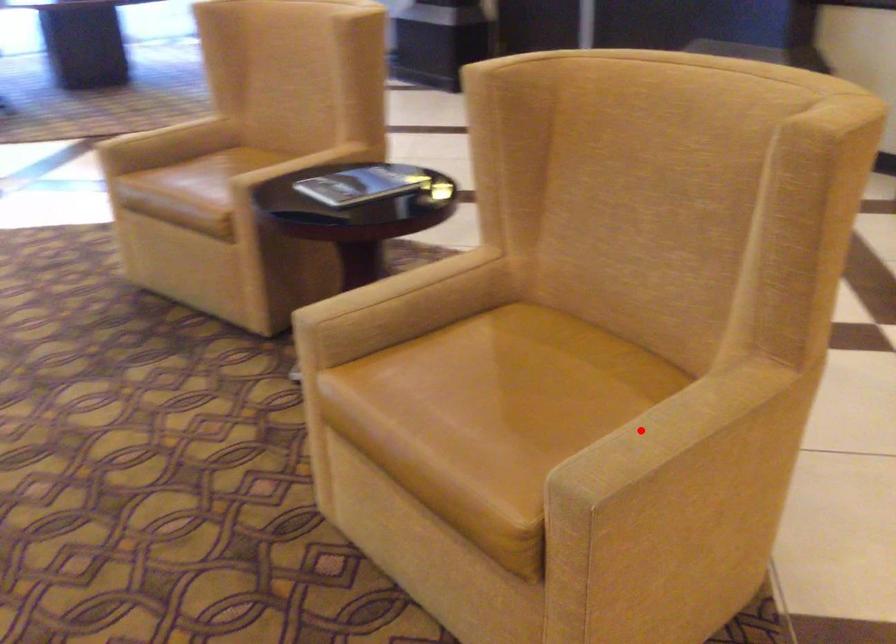
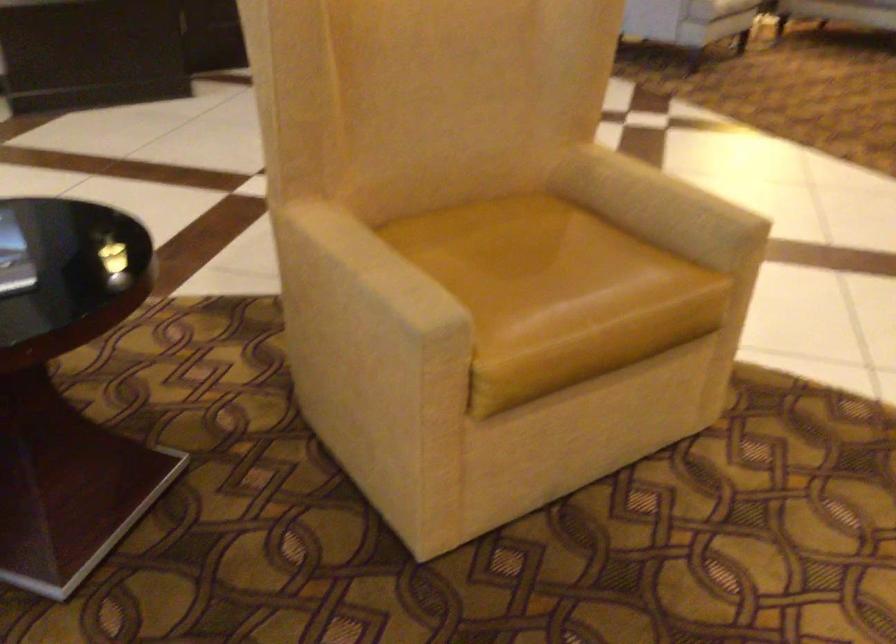
The point at the highlighted location is marked in the first image. Where is the corresponding point in the second image?

(659, 205)